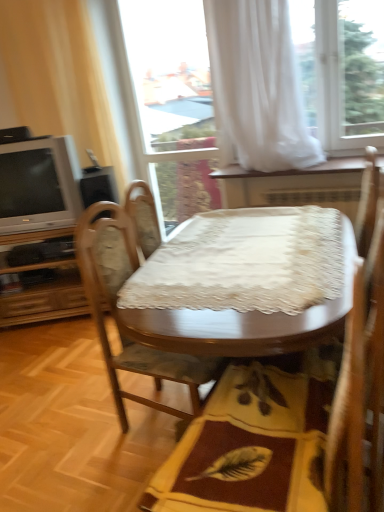
Question: Is wooden chair at center facing away from beige fabric curtain at left, which is counted as the 1th curtain, starting from the left?

Choices:
 (A) no
 (B) yes

Answer: (A)

Question: Is beige fabric curtain at left, which is counted as the 1th curtain, starting from the left, a part of wooden chair at center?

Choices:
 (A) yes
 (B) no

Answer: (B)

Question: Does wooden chair at center appear on the left side of beige fabric curtain at left, which ranks as the 2th curtain in right-to-left order?

Choices:
 (A) yes
 (B) no

Answer: (B)

Question: Is wooden chair at center closer to camera compared to beige fabric curtain at left, which ranks as the 2th curtain in right-to-left order?

Choices:
 (A) no
 (B) yes

Answer: (B)

Question: Can you confirm if wooden chair at center is smaller than beige fabric curtain at left, which ranks as the 2th curtain in right-to-left order?

Choices:
 (A) no
 (B) yes

Answer: (B)

Question: From the image's perspective, is wooden chair at center above or below wooden dresser at left?

Choices:
 (A) below
 (B) above

Answer: (A)

Question: Considering the positions of wooden chair at center and wooden dresser at left in the image, is wooden chair at center bigger or smaller than wooden dresser at left?

Choices:
 (A) big
 (B) small

Answer: (B)

Question: In terms of height, does wooden chair at center look taller or shorter compared to wooden dresser at left?

Choices:
 (A) tall
 (B) short

Answer: (A)

Question: Visually, is wooden chair at center positioned to the left or to the right of wooden dresser at left?

Choices:
 (A) left
 (B) right

Answer: (B)

Question: Is yellow fabric mat at center bigger or smaller than wooden chair at center?

Choices:
 (A) big
 (B) small

Answer: (B)

Question: Looking at their shapes, would you say yellow fabric mat at center is wider or thinner than wooden chair at center?

Choices:
 (A) thin
 (B) wide

Answer: (B)

Question: Based on their positions, is yellow fabric mat at center located to the left or right of wooden chair at center?

Choices:
 (A) right
 (B) left

Answer: (A)

Question: Is yellow fabric mat at center taller or shorter than wooden chair at center?

Choices:
 (A) short
 (B) tall

Answer: (A)

Question: From the image's perspective, is yellow fabric mat at center above or below transparent glass door at upper center?

Choices:
 (A) above
 (B) below

Answer: (B)

Question: Which is correct: yellow fabric mat at center is inside transparent glass door at upper center, or outside of it?

Choices:
 (A) outside
 (B) inside

Answer: (A)